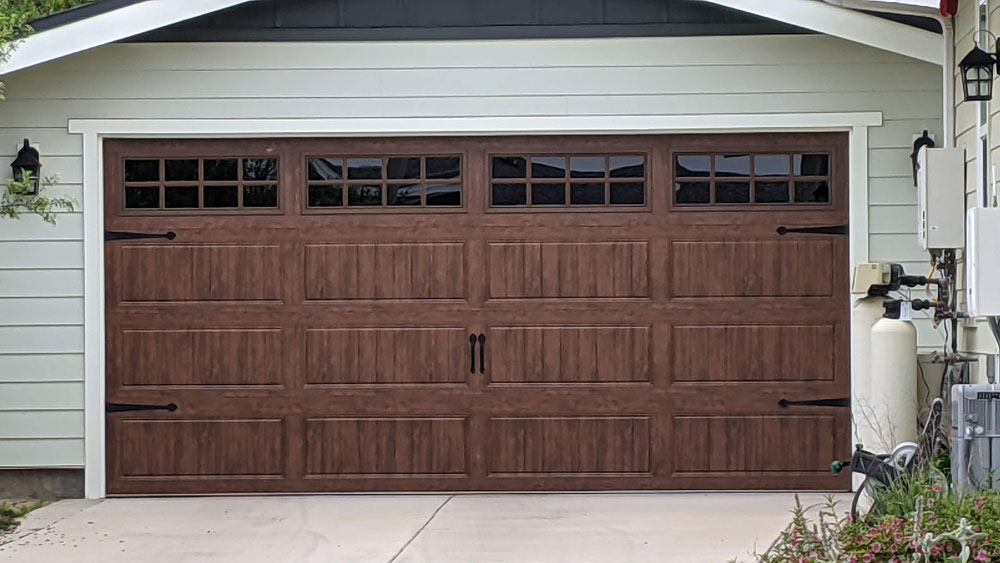
The width and height of the screenshot is (1000, 563). I want to click on lights, so click(x=25, y=175), click(x=924, y=138).